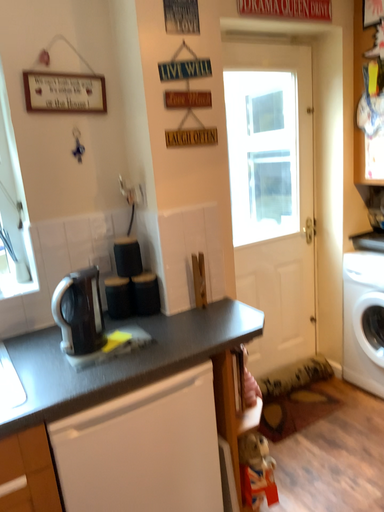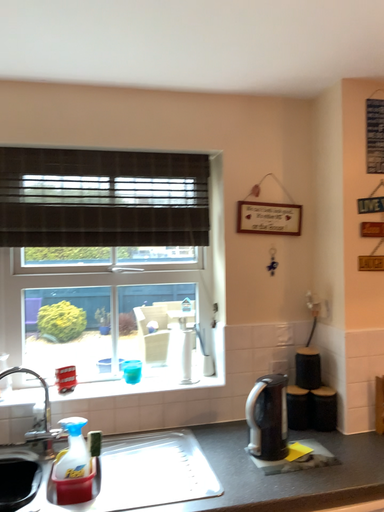
Question: How did the camera likely rotate when shooting the video?

Choices:
 (A) rotated left
 (B) rotated right

Answer: (A)